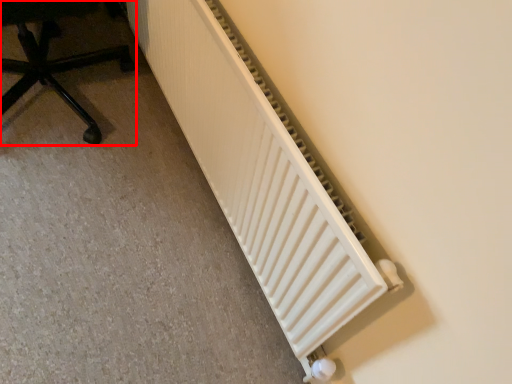
Question: Observing the image, what is the correct spatial positioning of furniture (annotated by the red box) in reference to radiator?

Choices:
 (A) left
 (B) right

Answer: (A)